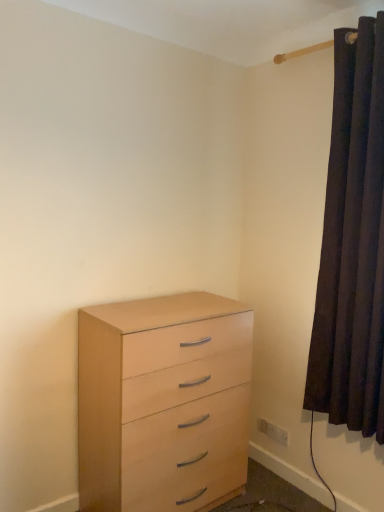
The height and width of the screenshot is (512, 384). What do you see at coordinates (273, 431) in the screenshot? I see `white plastic electric outlet at lower right` at bounding box center [273, 431].

Where is `light wood chest of drawers at lower left`? light wood chest of drawers at lower left is located at coordinates (163, 402).

You are a GUI agent. You are given a task and a screenshot of the screen. Output one action in this format:
    pyautogui.click(x=<x>, y=<y>)
    Task: Click on the white plastic electric outlet at lower right
    Image resolution: width=384 pixels, height=512 pixels.
    Given the screenshot: What is the action you would take?
    pyautogui.click(x=273, y=431)

Can dark velvet curtain at right be found inside white plastic electric outlet at lower right?

Actually, dark velvet curtain at right is outside white plastic electric outlet at lower right.

Looking at this image, how far apart are white plastic electric outlet at lower right and dark velvet curtain at right?

white plastic electric outlet at lower right is 3.55 feet away from dark velvet curtain at right.

From a real-world perspective, who is located lower, white plastic electric outlet at lower right or dark velvet curtain at right?

white plastic electric outlet at lower right is physically lower.

Consider the image. From a real-world perspective, which is physically above, dark velvet curtain at right or white plastic electric outlet at lower right?

dark velvet curtain at right.

Could you tell me if dark velvet curtain at right is facing white plastic electric outlet at lower right?

No, dark velvet curtain at right is not aimed at white plastic electric outlet at lower right.

Based on the photo, does dark velvet curtain at right have a lesser width compared to white plastic electric outlet at lower right?

No, dark velvet curtain at right is not thinner than white plastic electric outlet at lower right.

Is dark velvet curtain at right situated inside white plastic electric outlet at lower right or outside?

dark velvet curtain at right is located beyond the bounds of white plastic electric outlet at lower right.

Is light wood chest of drawers at lower left far away from white plastic electric outlet at lower right?

light wood chest of drawers at lower left is near white plastic electric outlet at lower right, not far away.

Between light wood chest of drawers at lower left and white plastic electric outlet at lower right, which one has less height?

white plastic electric outlet at lower right is shorter.

This screenshot has height=512, width=384. I want to click on chest of drawers that appears on the left of white plastic electric outlet at lower right, so click(163, 402).

Does light wood chest of drawers at lower left have a smaller size compared to dark velvet curtain at right?

Incorrect, light wood chest of drawers at lower left is not smaller in size than dark velvet curtain at right.

Looking at this image, how distant is light wood chest of drawers at lower left from dark velvet curtain at right?

A distance of 29.82 inches exists between light wood chest of drawers at lower left and dark velvet curtain at right.

Between light wood chest of drawers at lower left and dark velvet curtain at right, which one is positioned in front?

dark velvet curtain at right is closer to the camera.

Based on the photo, from a real-world perspective, is light wood chest of drawers at lower left physically below dark velvet curtain at right?

Indeed, from a real-world perspective, light wood chest of drawers at lower left is positioned beneath dark velvet curtain at right.

Find the location of `the chest of drawers that is below the dark velvet curtain at right (from the image's perspective)`. the chest of drawers that is below the dark velvet curtain at right (from the image's perspective) is located at coordinates (163, 402).

Between dark velvet curtain at right and light wood chest of drawers at lower left, which one has larger width?

Wider between the two is light wood chest of drawers at lower left.

Is dark velvet curtain at right positioned with its back to light wood chest of drawers at lower left?

No, dark velvet curtain at right is not facing the opposite direction of light wood chest of drawers at lower left.

Considering the positions of objects dark velvet curtain at right and light wood chest of drawers at lower left in the image provided, who is behind, dark velvet curtain at right or light wood chest of drawers at lower left?

light wood chest of drawers at lower left.

Considering the relative sizes of white plastic electric outlet at lower right and light wood chest of drawers at lower left in the image provided, is white plastic electric outlet at lower right smaller than light wood chest of drawers at lower left?

Yes.

Considering the sizes of objects white plastic electric outlet at lower right and light wood chest of drawers at lower left in the image provided, who is thinner, white plastic electric outlet at lower right or light wood chest of drawers at lower left?

white plastic electric outlet at lower right.

Choose the correct answer: Is white plastic electric outlet at lower right inside light wood chest of drawers at lower left or outside it?

white plastic electric outlet at lower right is located beyond the bounds of light wood chest of drawers at lower left.

Is white plastic electric outlet at lower right facing away from light wood chest of drawers at lower left?

No, white plastic electric outlet at lower right is not facing away from light wood chest of drawers at lower left.

This screenshot has height=512, width=384. I want to click on curtain above the white plastic electric outlet at lower right (from a real-world perspective), so click(x=352, y=242).

In the image, there is a white plastic electric outlet at lower right. Where is `curtain above it (from the image's perspective)`? The width and height of the screenshot is (384, 512). curtain above it (from the image's perspective) is located at coordinates (352, 242).

When comparing their distances from dark velvet curtain at right, does white plastic electric outlet at lower right or light wood chest of drawers at lower left seem further?

white plastic electric outlet at lower right.

Based on their spatial positions, is dark velvet curtain at right or light wood chest of drawers at lower left further from white plastic electric outlet at lower right?

Based on the image, dark velvet curtain at right appears to be further to white plastic electric outlet at lower right.

Looking at the image, which one is located further to light wood chest of drawers at lower left, dark velvet curtain at right or white plastic electric outlet at lower right?

white plastic electric outlet at lower right.

From the image, which object appears to be nearer to dark velvet curtain at right, light wood chest of drawers at lower left or white plastic electric outlet at lower right?

light wood chest of drawers at lower left is positioned closer to the anchor dark velvet curtain at right.

Which object lies nearer to the anchor point white plastic electric outlet at lower right, light wood chest of drawers at lower left or dark velvet curtain at right?

light wood chest of drawers at lower left is closer to white plastic electric outlet at lower right.

Based on their spatial positions, is white plastic electric outlet at lower right or dark velvet curtain at right further from light wood chest of drawers at lower left?

white plastic electric outlet at lower right.

The image size is (384, 512). I want to click on chest of drawers between dark velvet curtain at right and white plastic electric outlet at lower right from top to bottom, so click(163, 402).